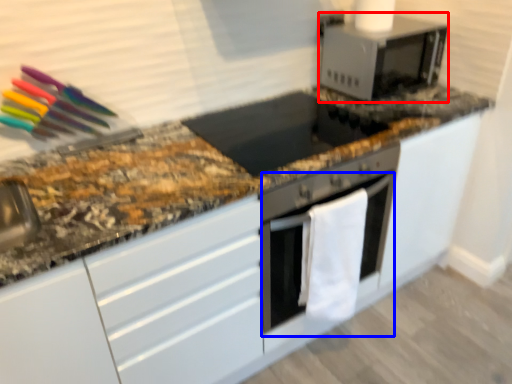
Question: Which object appears closest to the camera in this image, microwave oven (highlighted by a red box) or oven (highlighted by a blue box)?

Choices:
 (A) microwave oven
 (B) oven

Answer: (B)